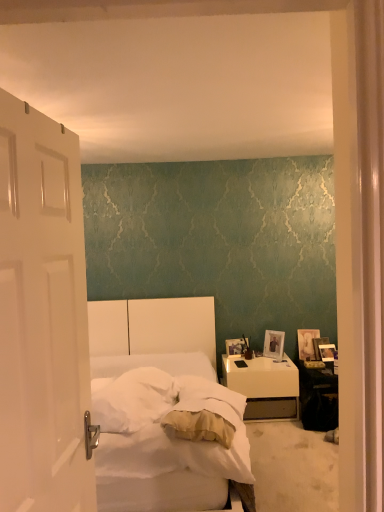
Question: Considering the positions of black glossy table at lower right and wooden photo frame at right, which ranks as the 1th picture frame in left-to-right order, in the image, is black glossy table at lower right taller or shorter than wooden photo frame at right, which ranks as the 1th picture frame in left-to-right order,?

Choices:
 (A) tall
 (B) short

Answer: (A)

Question: In the image, is black glossy table at lower right on the left side or the right side of wooden photo frame at right, which ranks as the 1th picture frame in left-to-right order?

Choices:
 (A) right
 (B) left

Answer: (A)

Question: Considering the real-world distances, which object is farthest from the wooden photo frame at right, the 5th picture frame positioned from the right?

Choices:
 (A) white matte door at left
 (B) silver metallic photo frame at right, which ranks as the 2th picture frame in left-to-right order
 (C) white soft pillow at center
 (D) wooden photo frame at right, the 3th picture frame positioned from the right
 (E) white soft bedsheet at center

Answer: (A)

Question: Which object is the farthest from the white soft pillow at center?

Choices:
 (A) wooden photo frame at right, the fourth picture frame in the left-to-right sequence
 (B) silver metallic photo frame at right, which is counted as the fourth picture frame, starting from the right
 (C) wooden photo frame at right, which is the 5th picture frame in left-to-right order
 (D) wooden photo frame at right, the 5th picture frame positioned from the right
 (E) wooden photo frame at right, the 3th picture frame positioned from the right

Answer: (A)